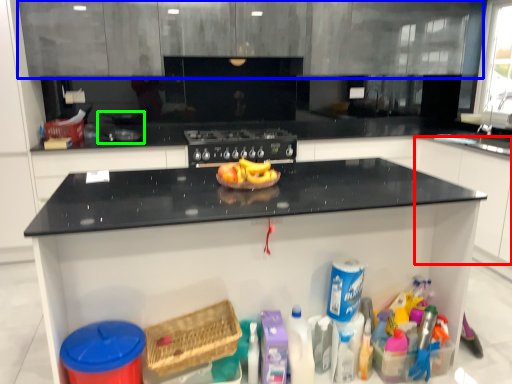
Question: Considering the real-world distances, which object is closest to cabinetry (highlighted by a red box)? cabinetry (highlighted by a blue box) or appliance (highlighted by a green box).

Choices:
 (A) cabinetry
 (B) appliance

Answer: (A)